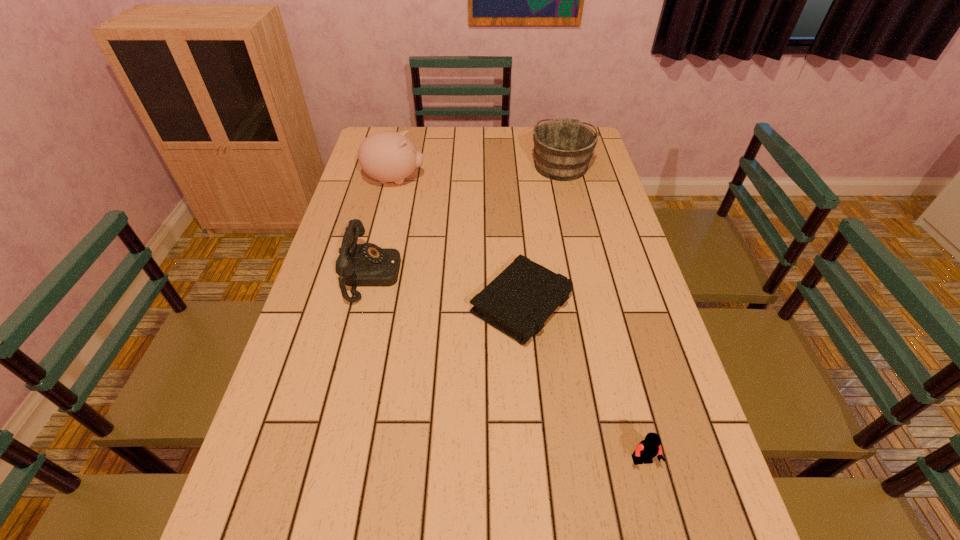
What are the coordinates of `free area in between the tallest object and the Bible` in the screenshot? It's located at (458, 242).

The width and height of the screenshot is (960, 540). Identify the location of vacant point located between the nearest object and the telephone. (508, 368).

Identify the location of free point between the telephone and the shortest object. (447, 290).

Find the location of a particular element. free space between the fourth tallest object and the shortest object is located at coordinates (583, 383).

Find the location of `free point between the telephone and the wine bucket`. free point between the telephone and the wine bucket is located at coordinates (467, 220).

The height and width of the screenshot is (540, 960). Find the location of `empty space between the piggy bank and the wine bucket`. empty space between the piggy bank and the wine bucket is located at coordinates (478, 172).

Identify the location of vacant area that lies between the telephone and the Bible. (447, 290).

Where is `vacant space that is in between the telephone and the wine bucket`? This screenshot has width=960, height=540. vacant space that is in between the telephone and the wine bucket is located at coordinates (467, 220).

Where is `free space that is in between the telephone and the Lego`? The width and height of the screenshot is (960, 540). free space that is in between the telephone and the Lego is located at coordinates (508, 368).

This screenshot has width=960, height=540. I want to click on object that is the fourth closest to the wine bucket, so click(x=648, y=448).